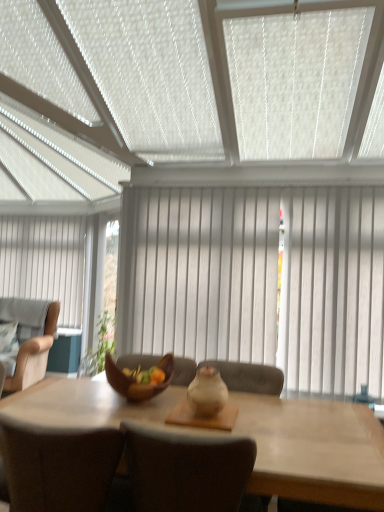
Question: From the image's perspective, is white textured window blind at upper center above white wood curtain at center, the second curtain in the back-to-front sequence?

Choices:
 (A) no
 (B) yes

Answer: (B)

Question: Could you tell me if white textured window blind at upper center is facing white wood curtain at center, the second curtain in the back-to-front sequence?

Choices:
 (A) yes
 (B) no

Answer: (B)

Question: Is white textured window blind at upper center smaller than white wood curtain at center, which ranks as the first curtain in front-to-back order?

Choices:
 (A) no
 (B) yes

Answer: (A)

Question: Does white textured window blind at upper center have a greater width compared to white wood curtain at center, arranged as the first curtain when viewed from the right?

Choices:
 (A) yes
 (B) no

Answer: (A)

Question: Is white textured window blind at upper center next to white wood curtain at center, arranged as the first curtain when viewed from the right?

Choices:
 (A) no
 (B) yes

Answer: (A)

Question: Considering the relative positions of white wood curtain at center, which ranks as the first curtain in front-to-back order, and matte beige chair at center, the 2th chair when ordered from front to back, in the image provided, is white wood curtain at center, which ranks as the first curtain in front-to-back order, to the left or to the right of matte beige chair at center, the 2th chair when ordered from front to back,?

Choices:
 (A) right
 (B) left

Answer: (A)

Question: Considering their positions, is white wood curtain at center, the second curtain in the back-to-front sequence, located in front of or behind matte beige chair at center, the second chair viewed from the back?

Choices:
 (A) behind
 (B) front

Answer: (A)

Question: From a real-world perspective, is white wood curtain at center, which ranks as the first curtain in front-to-back order, above or below matte beige chair at center, the second chair viewed from the back?

Choices:
 (A) below
 (B) above

Answer: (B)

Question: From the image's perspective, is white wood curtain at center, positioned as the second curtain in left-to-right order, located above or below matte beige chair at center, arranged as the third chair when viewed from the left?

Choices:
 (A) above
 (B) below

Answer: (A)

Question: Relative to brown fabric chair at center, positioned as the 2th chair in right-to-left order, is white textured window blind at upper center in front or behind?

Choices:
 (A) front
 (B) behind

Answer: (A)

Question: Is white textured window blind at upper center wider or thinner than brown fabric chair at center, acting as the 3th chair starting from the back?

Choices:
 (A) thin
 (B) wide

Answer: (B)

Question: From the image's perspective, relative to brown fabric chair at center, positioned as the 2th chair in right-to-left order, is white textured window blind at upper center above or below?

Choices:
 (A) above
 (B) below

Answer: (A)

Question: From their relative heights in the image, would you say white textured window blind at upper center is taller or shorter than brown fabric chair at center, positioned as the 2th chair in right-to-left order?

Choices:
 (A) short
 (B) tall

Answer: (B)

Question: Considering the positions of brown fabric chair at center, acting as the 3th chair starting from the back, and white wood curtain at center, positioned as the second curtain in left-to-right order, in the image, is brown fabric chair at center, acting as the 3th chair starting from the back, bigger or smaller than white wood curtain at center, positioned as the second curtain in left-to-right order,?

Choices:
 (A) big
 (B) small

Answer: (A)

Question: From a real-world perspective, relative to white wood curtain at center, the second curtain in the back-to-front sequence, is brown fabric chair at center, the first chair in the front-to-back sequence, vertically above or below?

Choices:
 (A) above
 (B) below

Answer: (B)